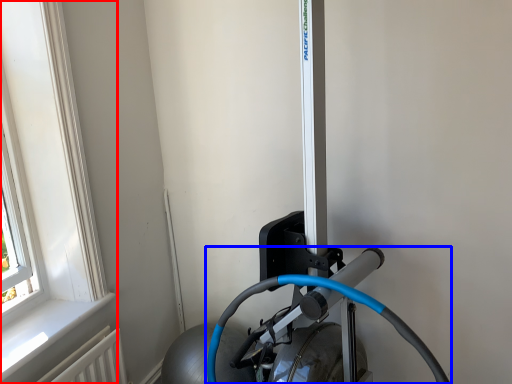
Question: Which object is closer to the camera taking this photo, window (highlighted by a red box) or sport equipment (highlighted by a blue box)?

Choices:
 (A) window
 (B) sport equipment

Answer: (B)